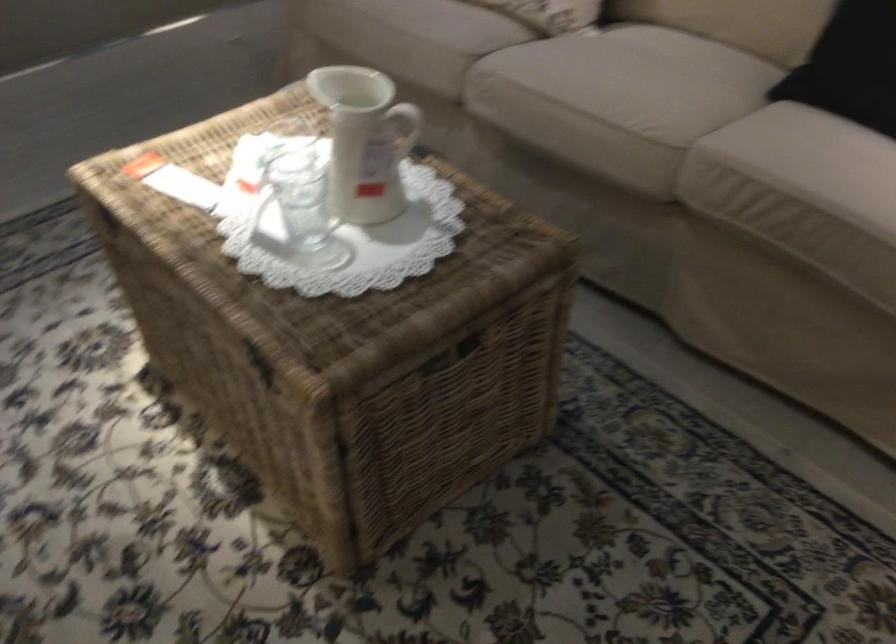
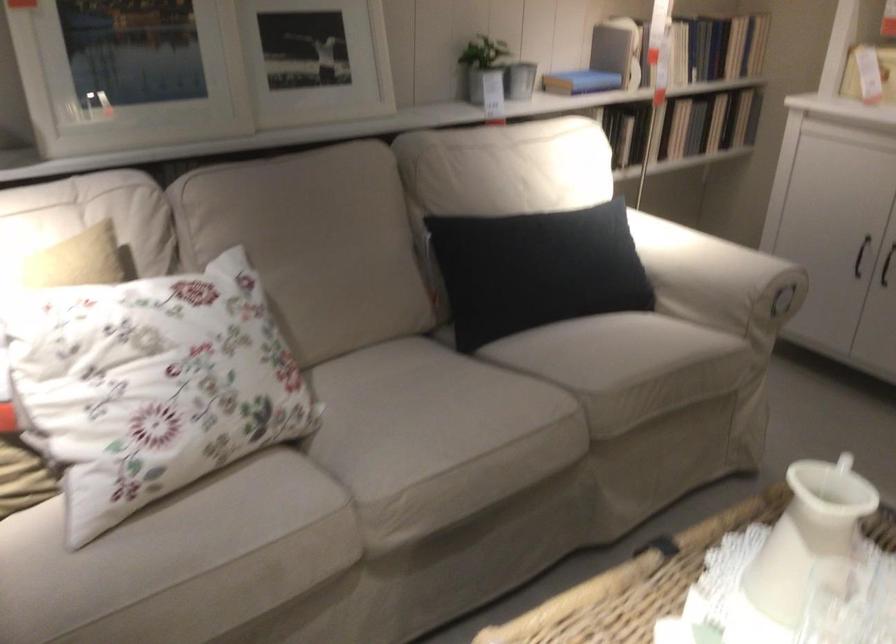
The point at (357, 160) is marked in the first image. Where is the corresponding point in the second image?

(803, 552)